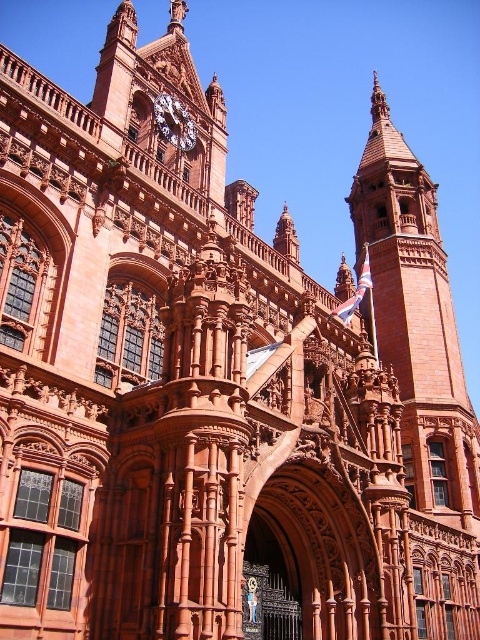
Who is positioned more to the right, brick tower at upper right or polished brass clock at upper center?

From the viewer's perspective, brick tower at upper right appears more on the right side.

Does brick tower at upper right appear on the right side of polished brass clock at upper center?

Correct, you'll find brick tower at upper right to the right of polished brass clock at upper center.

Is point (420, 385) positioned behind point (193, 122)?

Yes, it is behind point (193, 122).

This screenshot has width=480, height=640. In order to click on brick tower at upper right in this screenshot , I will do click(417, 321).